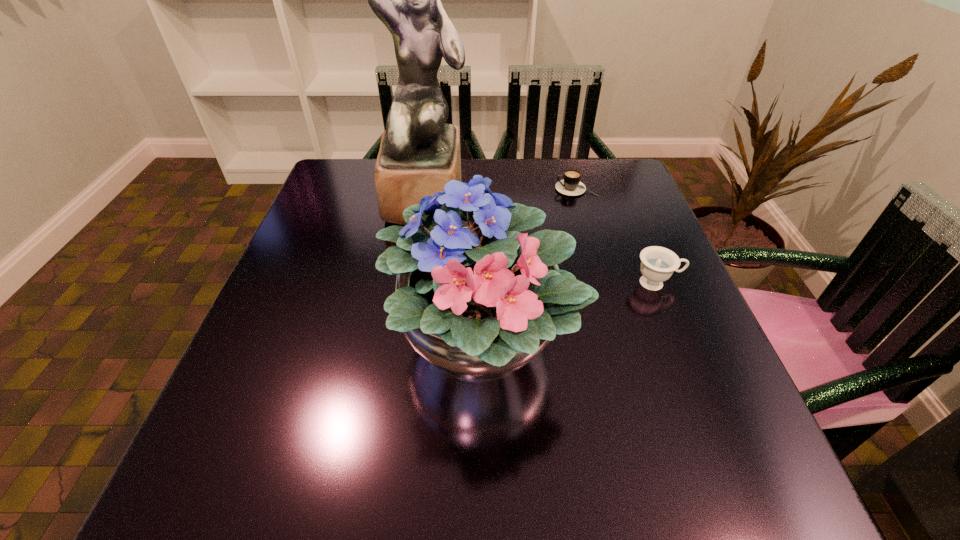
Locate an element on the screen. The width and height of the screenshot is (960, 540). blank space located 0.290m with the handle on the side of the cappuccino is located at coordinates point(447,189).

At what (x,y) coordinates should I click in order to perform the action: click on sculpture present at the far edge. Please return your answer as a coordinate pair (x, y). The width and height of the screenshot is (960, 540). Looking at the image, I should click on (419, 153).

This screenshot has width=960, height=540. I want to click on cappuccino that is at the far edge, so click(571, 185).

Find the location of a particular element. This screenshot has width=960, height=540. teacup present at the right edge is located at coordinates [x=657, y=265].

You are a GUI agent. You are given a task and a screenshot of the screen. Output one action in this format:
    pyautogui.click(x=<x>, y=<y>)
    Task: Click on the cappuccino positioned at the right edge
    The image size is (960, 540).
    Given the screenshot: What is the action you would take?
    pyautogui.click(x=571, y=185)

This screenshot has height=540, width=960. Find the location of `object positioned at the far right corner`. object positioned at the far right corner is located at coordinates (571, 185).

This screenshot has width=960, height=540. I want to click on vacant space at the far edge of the desktop, so click(x=492, y=165).

At what (x,y) coordinates should I click in order to perform the action: click on free point at the near edge. Please return your answer as a coordinate pair (x, y). This screenshot has height=540, width=960. Looking at the image, I should click on (381, 472).

In the image, there is a desktop. Identify the location of vacant space at the left edge. (289, 265).

In the image, there is a desktop. Where is `free space at the right edge`? Image resolution: width=960 pixels, height=540 pixels. free space at the right edge is located at coordinates (696, 361).